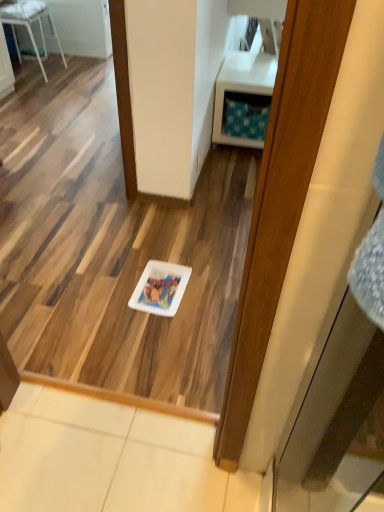
You are a GUI agent. You are given a task and a screenshot of the screen. Output one action in this format:
    pyautogui.click(x=<x>, y=<y>)
    Task: Click on the free space above white glossy plate at center (from a real-world perspective)
    The image size is (384, 512).
    Given the screenshot: What is the action you would take?
    pyautogui.click(x=163, y=286)